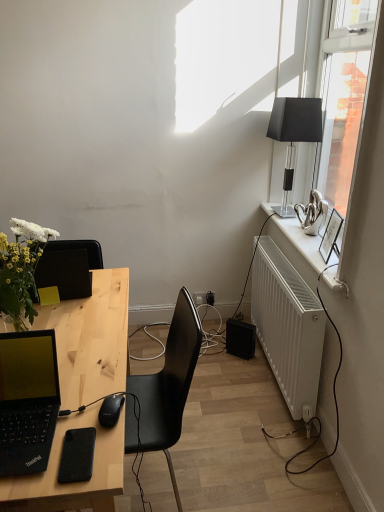
Locate an element on the screen. The width and height of the screenshot is (384, 512). vacant space that is to the left of black matte phone at lower left is located at coordinates (34, 446).